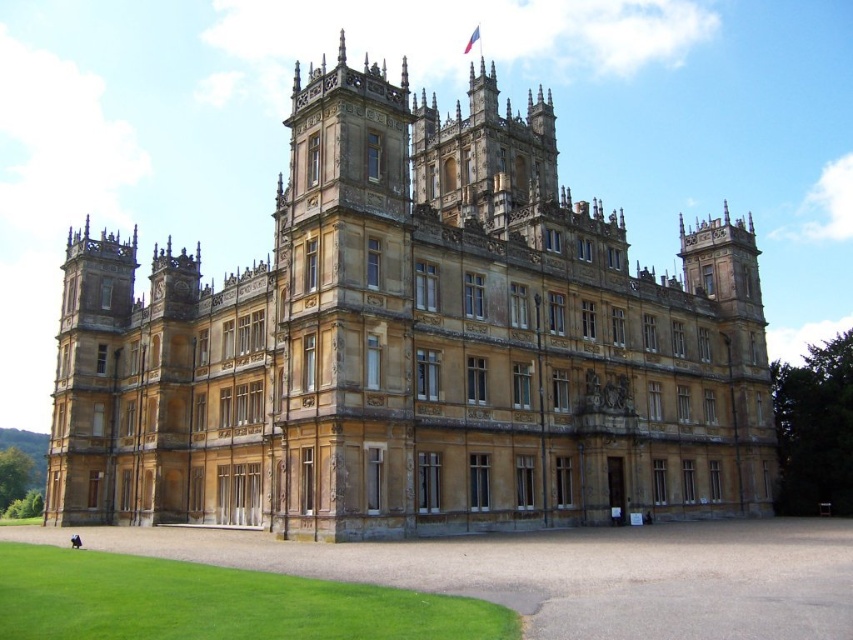
Question: From the image, what is the correct spatial relationship of golden stone castle at center in relation to green grass at lower left?

Choices:
 (A) below
 (B) above

Answer: (B)

Question: Which point is farther from the camera taking this photo?

Choices:
 (A) (103, 628)
 (B) (415, 106)

Answer: (B)

Question: Does golden stone castle at center come in front of green grass at lower left?

Choices:
 (A) yes
 (B) no

Answer: (B)

Question: Which of the following is the closest to the observer?

Choices:
 (A) green grass at lower left
 (B) golden stone castle at center

Answer: (A)

Question: Which point appears closest to the camera in this image?

Choices:
 (A) (518, 220)
 (B) (74, 632)

Answer: (B)

Question: Does golden stone castle at center appear on the right side of green grass at lower left?

Choices:
 (A) yes
 (B) no

Answer: (A)